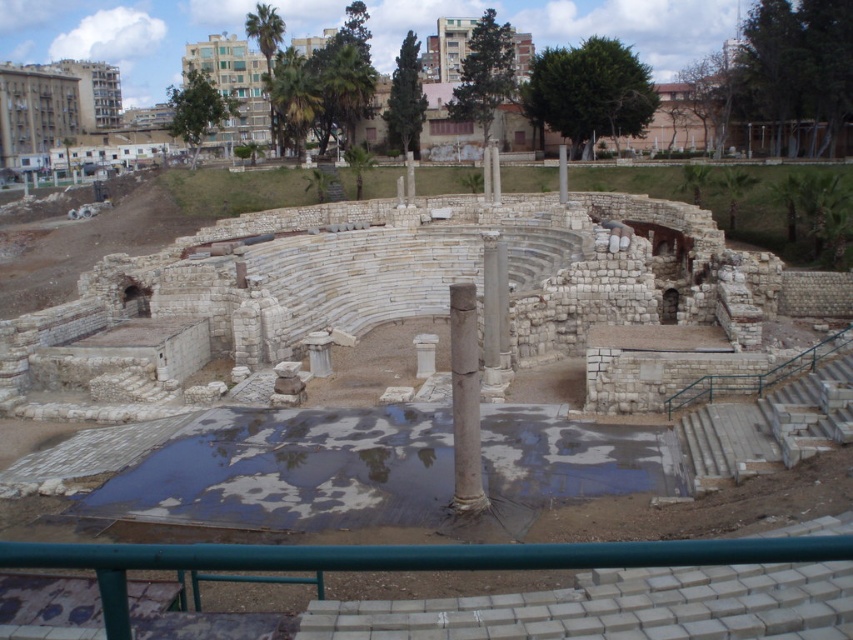
Question: Can you confirm if white marble column at center is positioned to the left of gray stone column at center?

Choices:
 (A) no
 (B) yes

Answer: (B)

Question: Does reflective concrete puddle at center have a greater width compared to gray stone column at center?

Choices:
 (A) yes
 (B) no

Answer: (A)

Question: Does white marble column at center lie behind gray stone column at center?

Choices:
 (A) no
 (B) yes

Answer: (A)

Question: Which point is closer to the camera?

Choices:
 (A) (560, 173)
 (B) (459, 282)
 (C) (401, 474)

Answer: (C)

Question: Which point appears closest to the camera in this image?

Choices:
 (A) (467, 344)
 (B) (492, 358)
 (C) (112, 509)
 (D) (566, 172)

Answer: (A)

Question: Which object appears closest to the camera in this image?

Choices:
 (A) white marble column at center
 (B) reflective concrete puddle at center
 (C) white stone pillar at center
 (D) gray stone column at center

Answer: (B)